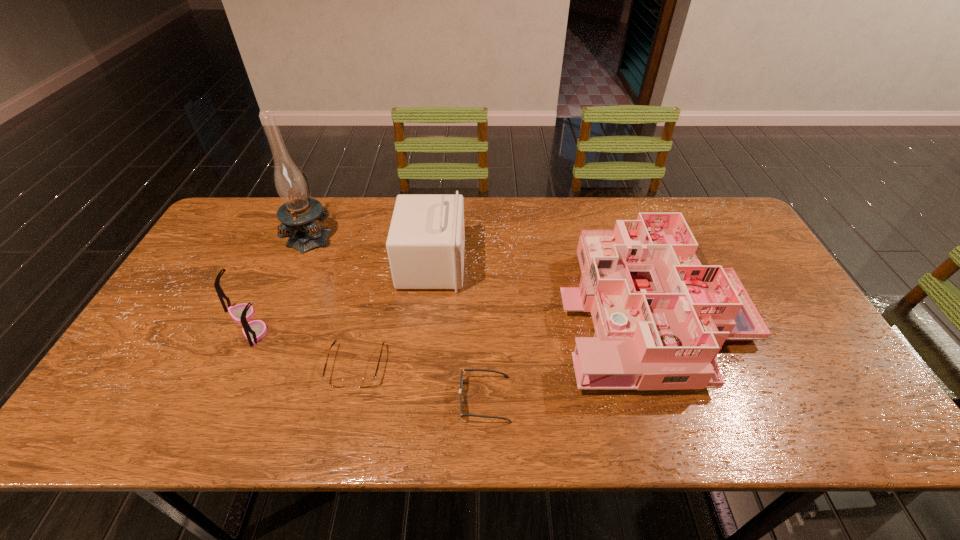
This screenshot has width=960, height=540. What are the coordinates of `vacant region that satisfies the following two spatial constraints: 1. at the front entrance of the rightmost object; 2. on the front-facing side of the second spectacles from right to left` in the screenshot? It's located at (672, 366).

The height and width of the screenshot is (540, 960). What are the coordinates of `vacant area that satisfies the following two spatial constraints: 1. at the front entrance of the dollhouse; 2. on the front side of the tallest spectacles` in the screenshot? It's located at (657, 324).

Locate an element on the screen. Image resolution: width=960 pixels, height=540 pixels. blank space that satisfies the following two spatial constraints: 1. at the front entrance of the rightmost object; 2. on the front-facing side of the second spectacles from left to right is located at coordinates (672, 366).